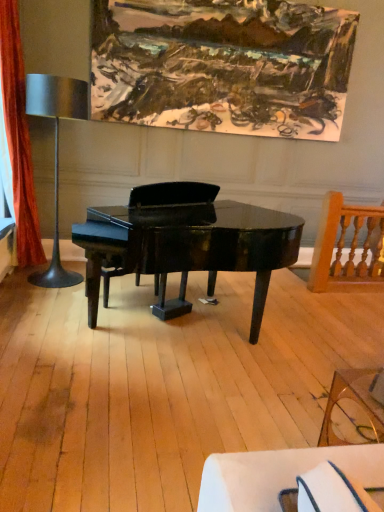
Find the location of a particular element. This screenshot has height=512, width=384. vacant space in front of glossy black piano at center is located at coordinates (191, 425).